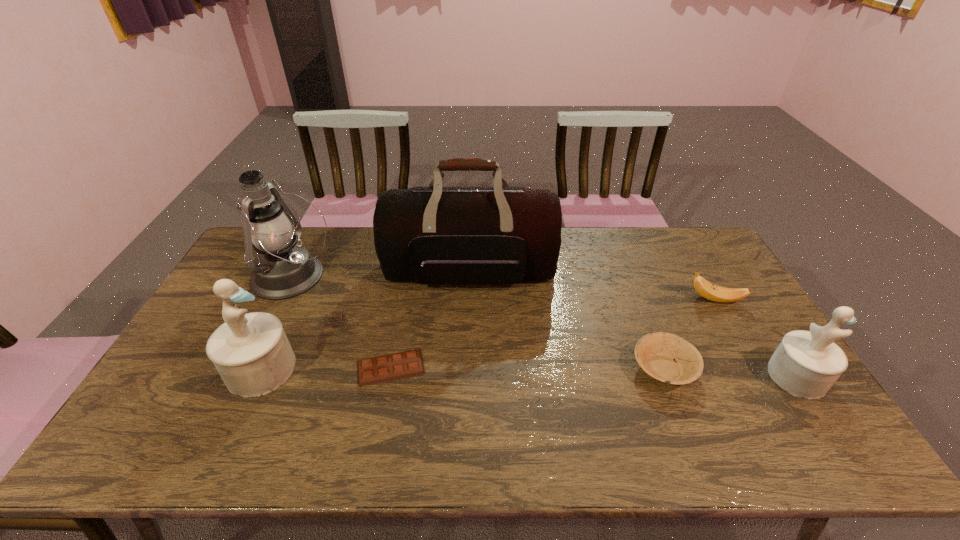
Image resolution: width=960 pixels, height=540 pixels. What are the coordinates of `empty space that is in between the fifth tallest object and the duffel bag` in the screenshot? It's located at [x=592, y=285].

This screenshot has width=960, height=540. I want to click on the fourth closest object to the third object from right to left, so click(x=394, y=366).

Image resolution: width=960 pixels, height=540 pixels. I want to click on object that is the closest to the fifth shortest object, so pyautogui.click(x=282, y=270).

Locate an element on the screen. free location that satisfies the following two spatial constraints: 1. on the front pocket of the duffel bag; 2. on the right side of the third shortest object is located at coordinates (469, 299).

The height and width of the screenshot is (540, 960). What are the coordinates of `free space that satisfies the following two spatial constraints: 1. on the front pocket of the fifth object from left to right; 2. on the left side of the duffel bag` in the screenshot? It's located at (468, 369).